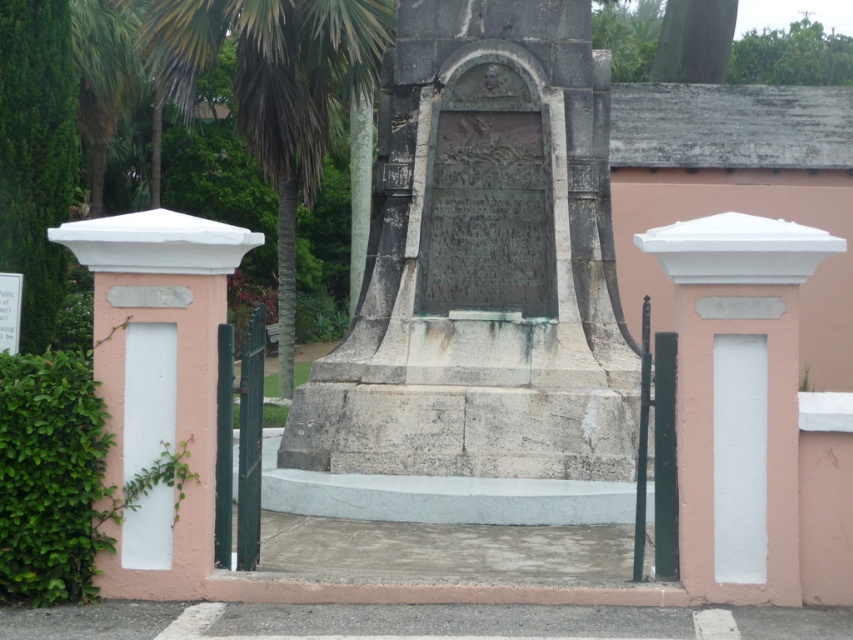
Identify the location of gray stone monument at center. (483, 262).

Is point (526, 3) behind point (306, 144)?

No, it is in front of (306, 144).

Describe the element at coordinates (483, 262) in the screenshot. The width and height of the screenshot is (853, 640). I see `gray stone monument at center` at that location.

The image size is (853, 640). I want to click on gray stone monument at center, so click(483, 262).